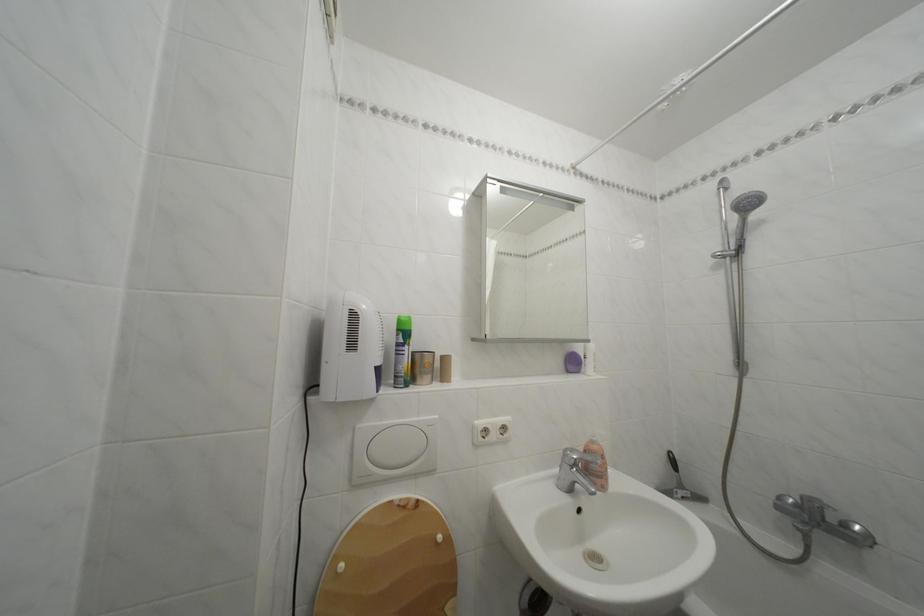
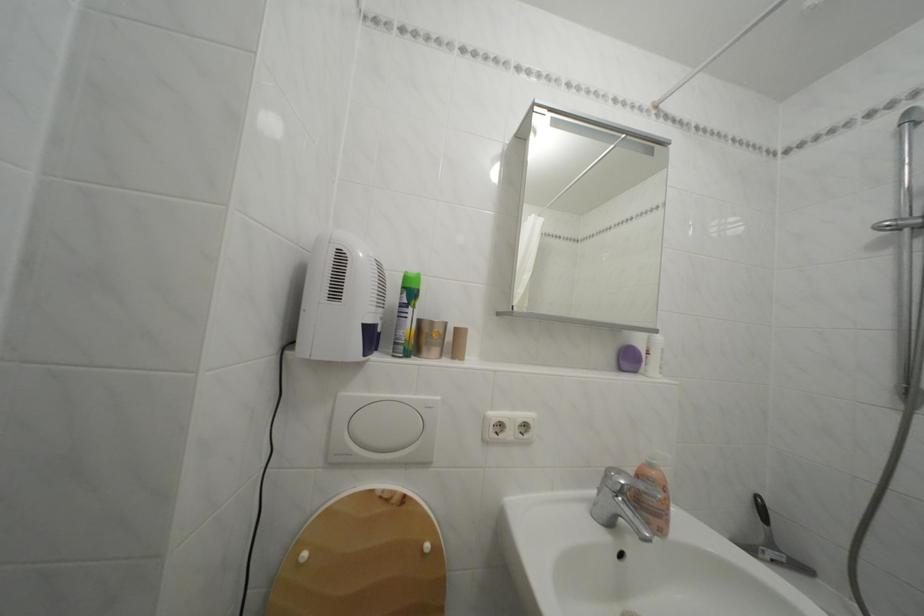
Question: The camera is either moving clockwise (left) or counter-clockwise (right) around the object. The first image is from the beginning of the video and the second image is from the end. Is the camera moving left or right when shooting the video?

Choices:
 (A) Left
 (B) Right

Answer: (B)